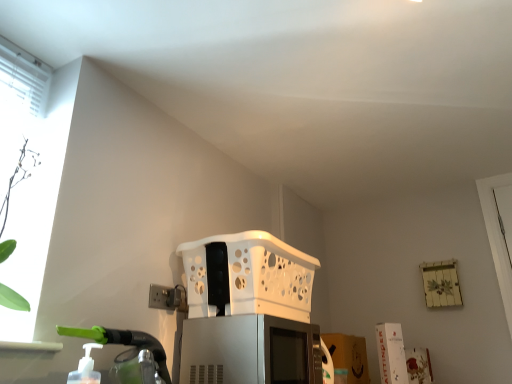
Question: Is white plastic basket at center not near white plastic electric outlet at lower left?

Choices:
 (A) no
 (B) yes

Answer: (A)

Question: Does white plastic basket at center come behind white plastic electric outlet at lower left?

Choices:
 (A) no
 (B) yes

Answer: (A)

Question: From a real-world perspective, is white plastic basket at center physically below white plastic electric outlet at lower left?

Choices:
 (A) no
 (B) yes

Answer: (A)

Question: Considering the relative sizes of white plastic basket at center and white plastic electric outlet at lower left in the image provided, is white plastic basket at center taller than white plastic electric outlet at lower left?

Choices:
 (A) yes
 (B) no

Answer: (A)

Question: Is white plastic basket at center thinner than white plastic electric outlet at lower left?

Choices:
 (A) no
 (B) yes

Answer: (A)

Question: Choose the correct answer: Is white plastic basket at center inside satin silver microwave at center or outside it?

Choices:
 (A) outside
 (B) inside

Answer: (A)

Question: From the image's perspective, relative to satin silver microwave at center, is white plastic basket at center above or below?

Choices:
 (A) below
 (B) above

Answer: (B)

Question: In the image, is white plastic basket at center positioned in front of or behind satin silver microwave at center?

Choices:
 (A) front
 (B) behind

Answer: (B)

Question: Looking at the image, does white plastic basket at center seem bigger or smaller compared to satin silver microwave at center?

Choices:
 (A) small
 (B) big

Answer: (B)

Question: Would you say satin silver microwave at center is to the left or to the right of white plastic basket at center in the picture?

Choices:
 (A) left
 (B) right

Answer: (B)

Question: Considering the positions of point (218, 379) and point (303, 276), is point (218, 379) closer or farther from the camera than point (303, 276)?

Choices:
 (A) closer
 (B) farther

Answer: (A)

Question: Based on their sizes in the image, would you say satin silver microwave at center is bigger or smaller than white plastic basket at center?

Choices:
 (A) big
 (B) small

Answer: (B)

Question: From their relative heights in the image, would you say satin silver microwave at center is taller or shorter than white plastic basket at center?

Choices:
 (A) short
 (B) tall

Answer: (A)

Question: Would you say white plastic electric outlet at lower left is inside or outside satin silver microwave at center?

Choices:
 (A) outside
 (B) inside

Answer: (A)

Question: Based on their sizes in the image, would you say white plastic electric outlet at lower left is bigger or smaller than satin silver microwave at center?

Choices:
 (A) small
 (B) big

Answer: (A)